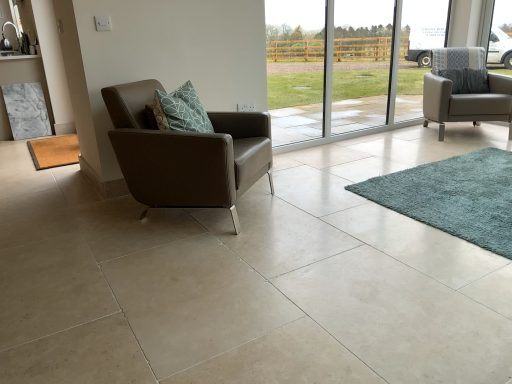
Locate an element on the screen. This screenshot has height=384, width=512. free point to the left of brown leather armchair at left, placed as the second chair when sorted from back to front is located at coordinates (x=66, y=220).